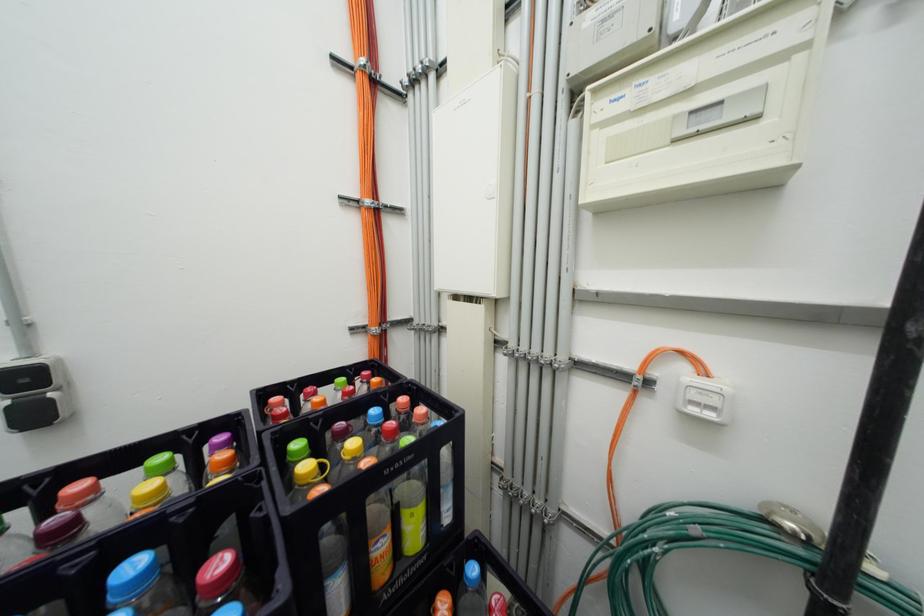
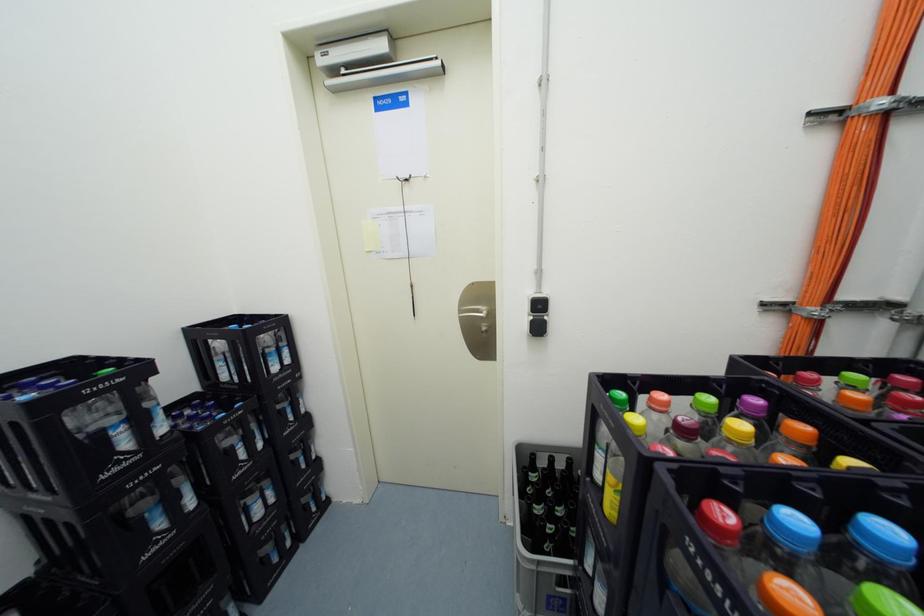
Question: How did the camera likely rotate?

Choices:
 (A) Left
 (B) Right
 (C) Up
 (D) Down

Answer: (A)